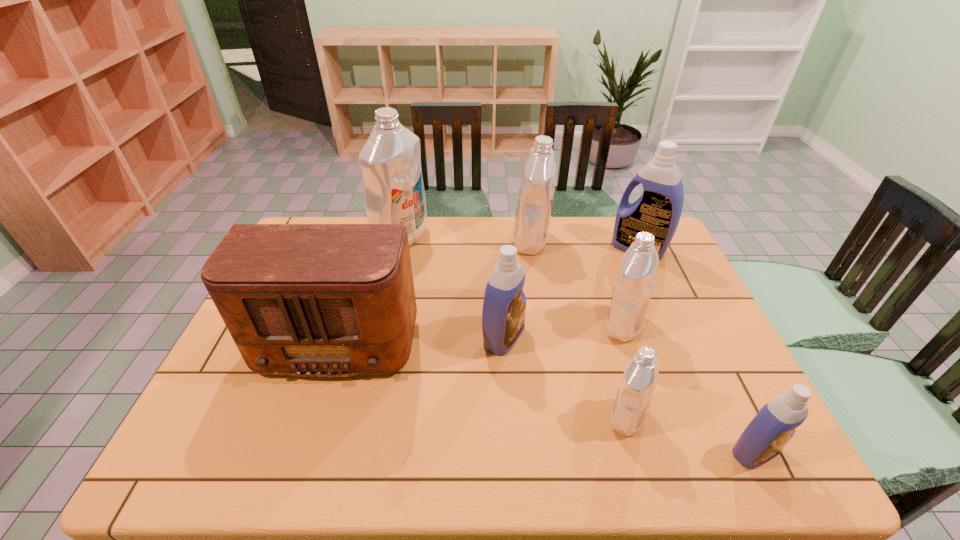
Find the location of a particular element. free space between the leftmost white detergent and the second white detergent from left to right is located at coordinates (466, 240).

Locate an element on the screen. The height and width of the screenshot is (540, 960). vacant area that lies between the second biggest blue detergent and the second smallest white detergent is located at coordinates (564, 332).

Find the location of a particular element. free spot between the second white detergent from left to right and the radio receiver is located at coordinates (436, 286).

Identify which object is located as the fifth nearest to the leftmost detergent. Please provide its 2D coordinates. Your answer should be formatted as a tuple, i.e. [(x, y)], where the tuple contains the x and y coordinates of a point satisfying the conditions above.

[(658, 211)]

Identify which object is the seventh nearest to the third white detergent from right to left. Please provide its 2D coordinates. Your answer should be formatted as a tuple, i.e. [(x, y)], where the tuple contains the x and y coordinates of a point satisfying the conditions above.

[(763, 439)]

At what (x,y) coordinates should I click in order to perform the action: click on detergent that is the fourth closest one to the tallest object. Please return your answer as a coordinate pair (x, y). Looking at the image, I should click on (658, 211).

At what (x,y) coordinates should I click in order to perform the action: click on detergent that stands as the second closest to the second biggest white detergent. Please return your answer as a coordinate pair (x, y). Image resolution: width=960 pixels, height=540 pixels. Looking at the image, I should click on (634, 284).

Identify the location of white detergent that is the fourth closest to the brown radio receiver. (634, 284).

I want to click on the third closest white detergent to the leftmost white detergent, so click(636, 389).

Where is `blue detergent object that ranks as the closest to the tallest detergent`? blue detergent object that ranks as the closest to the tallest detergent is located at coordinates (503, 316).